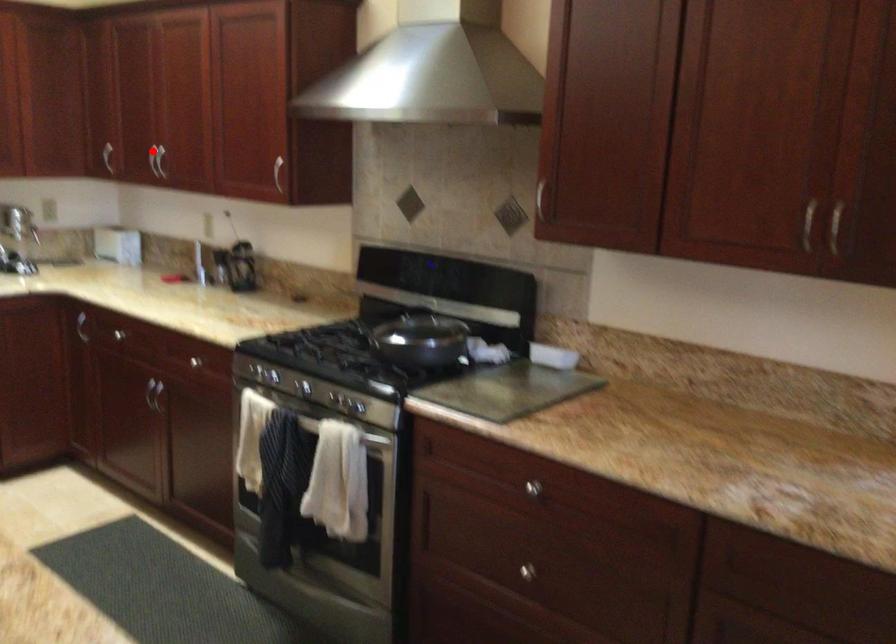
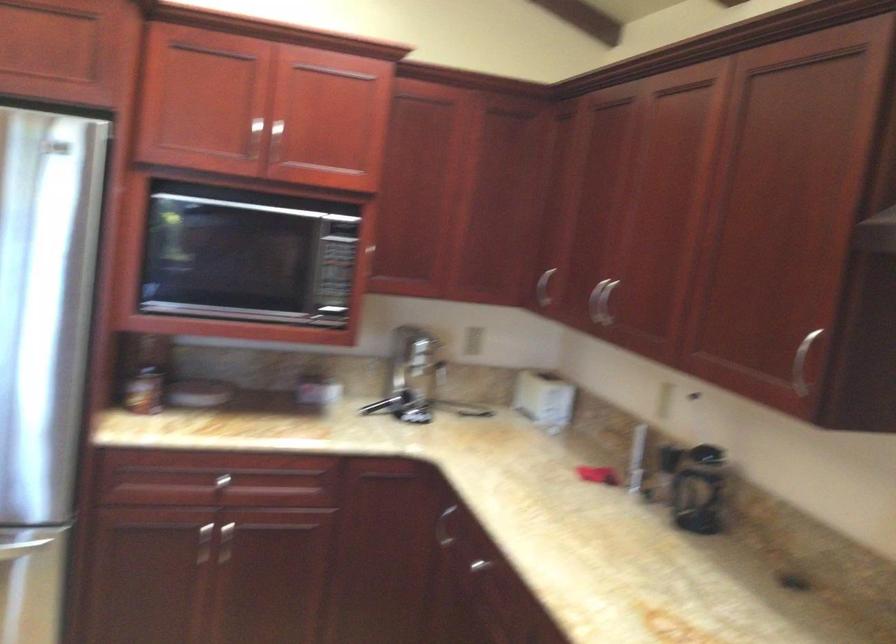
The point at the highlighted location is marked in the first image. Where is the corresponding point in the second image?

(600, 301)